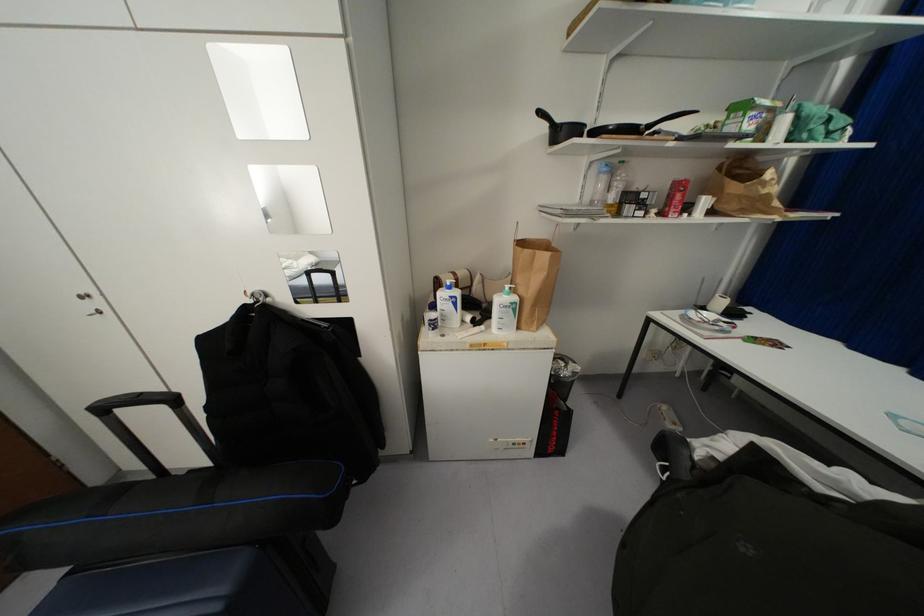
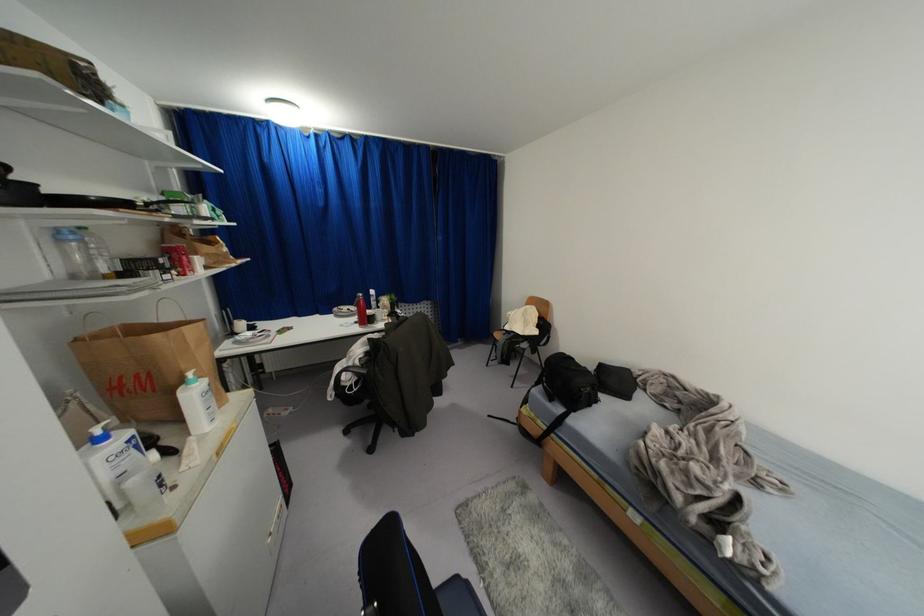
In the second image, find the point that corresponds to [447,283] in the first image.

(98, 431)